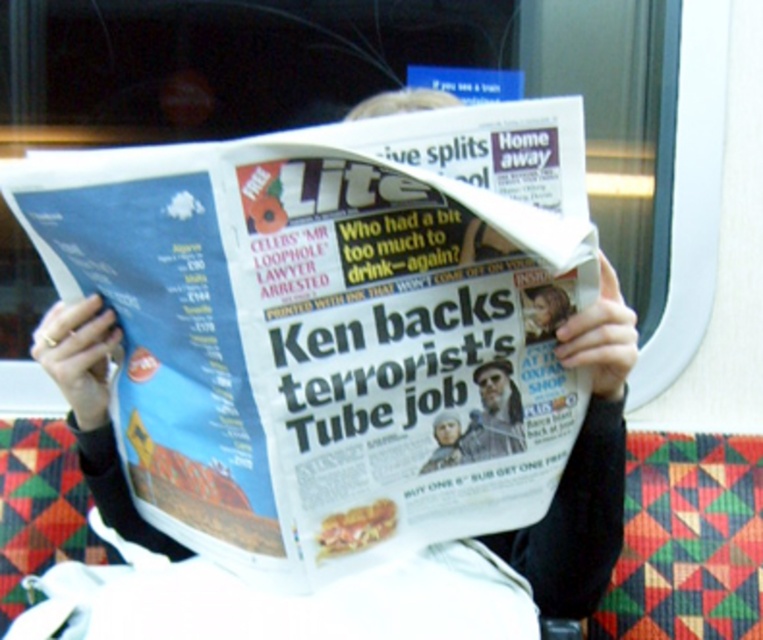
Can you confirm if white glossy newspaper at center is bigger than gray beard at center?

Indeed, white glossy newspaper at center has a larger size compared to gray beard at center.

Is white glossy newspaper at center above gray beard at center?

Indeed, white glossy newspaper at center is positioned over gray beard at center.

What do you see at coordinates (330, 323) in the screenshot?
I see `white glossy newspaper at center` at bounding box center [330, 323].

What are the coordinates of `white glossy newspaper at center` in the screenshot? It's located at (330, 323).